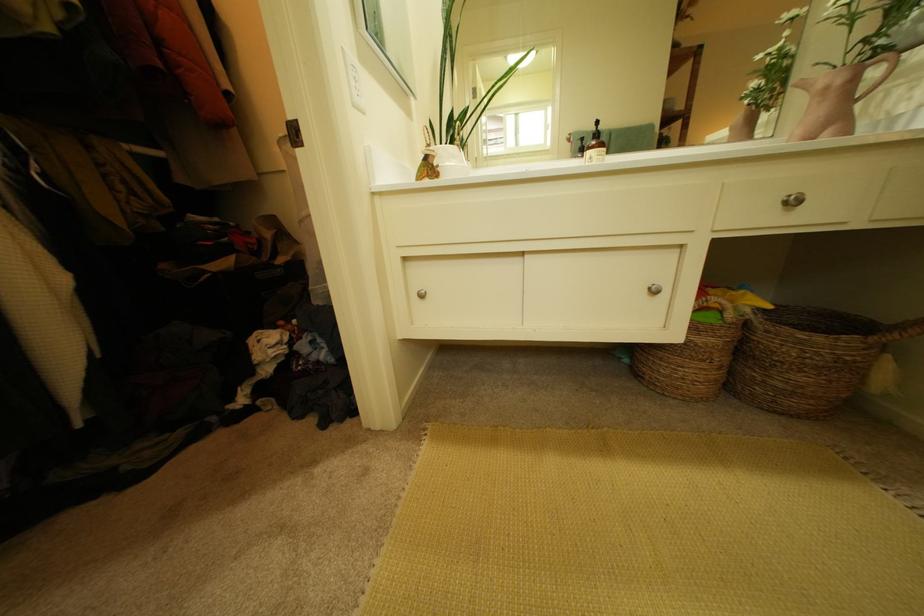
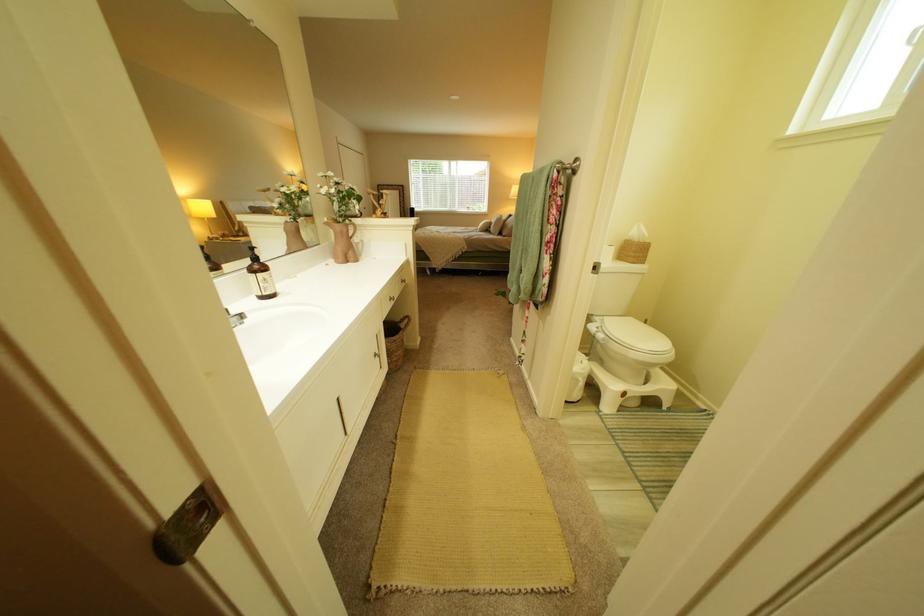
Where in the second image is the point corresponding to pixel 670 293 from the first image?

(391, 357)